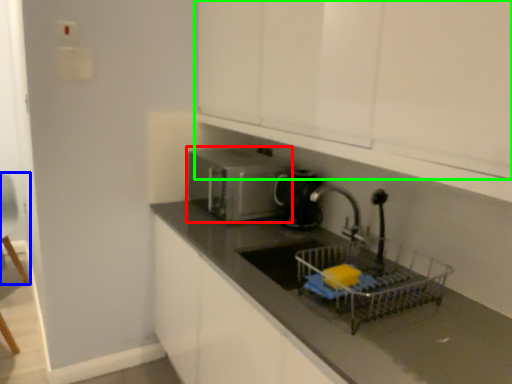
Question: Estimate the real-world distances between objects in this image. Which object is closer to home appliance (highlighted by a red box), armchair (highlighted by a blue box) or cabinetry (highlighted by a green box)?

Choices:
 (A) armchair
 (B) cabinetry

Answer: (B)